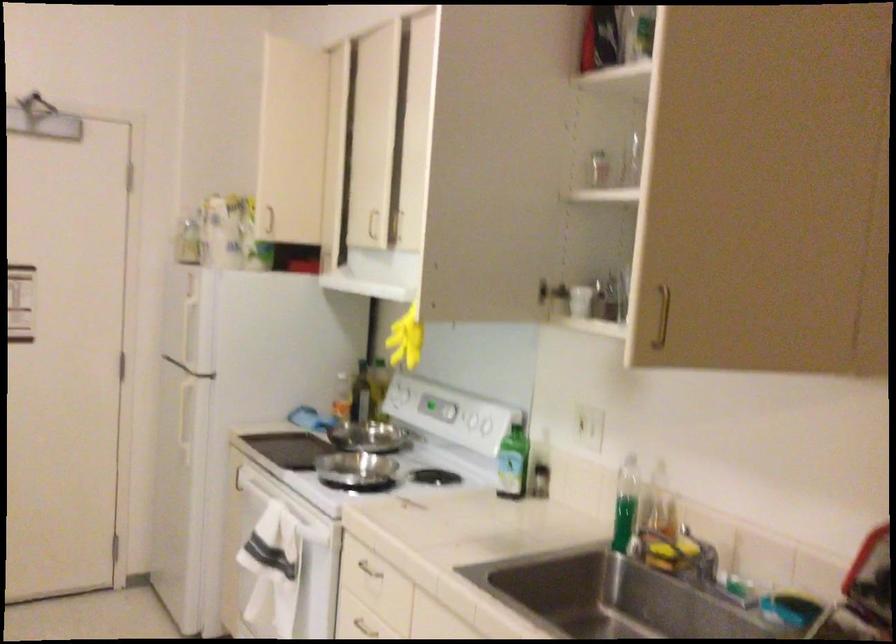
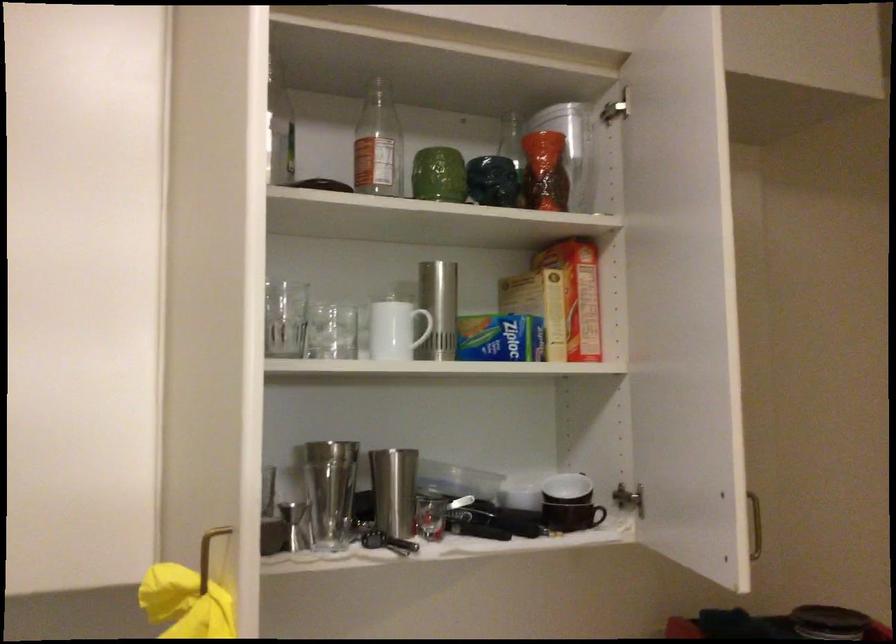
Find the pixel in the second image that matches point (815, 328) in the first image.

(521, 489)